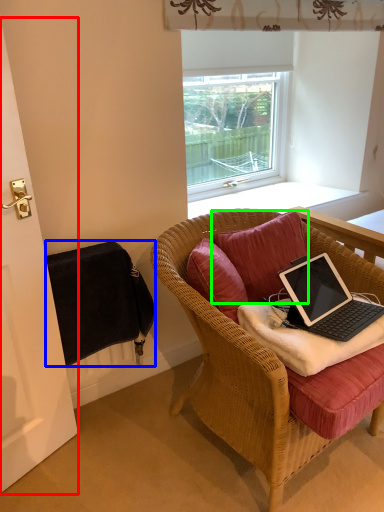
Question: Which object is the closest to the screen door (highlighted by a red box)? Choose among these: radiator (highlighted by a blue box) or pillow (highlighted by a green box).

Choices:
 (A) radiator
 (B) pillow

Answer: (A)